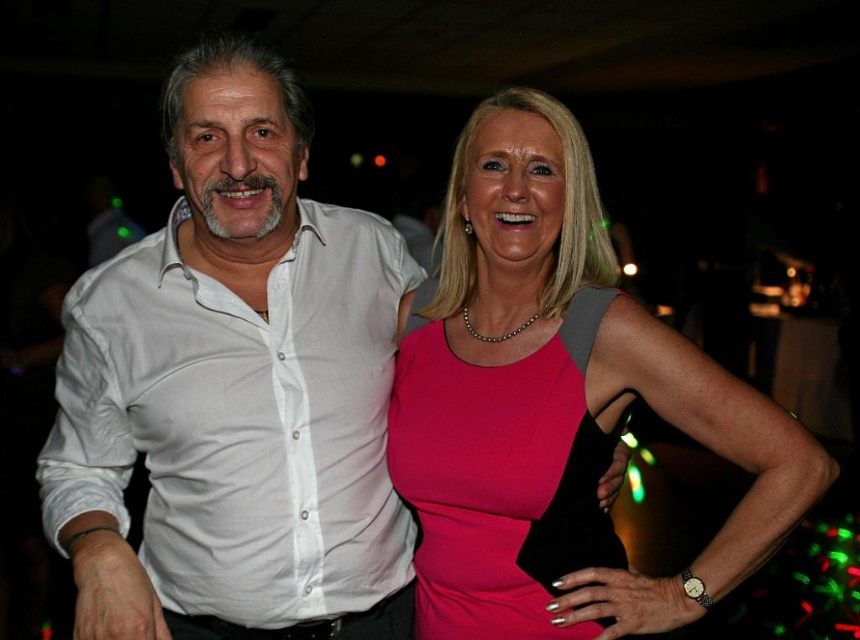
Between point (215, 536) and point (542, 596), which one is positioned in front?

Point (542, 596)

Is white cotton shirt at left to the right of pink satin dress at center from the viewer's perspective?

Incorrect, white cotton shirt at left is not on the right side of pink satin dress at center.

This screenshot has width=860, height=640. Identify the location of white cotton shirt at left. (235, 390).

You are a GUI agent. You are given a task and a screenshot of the screen. Output one action in this format:
    pyautogui.click(x=<x>, y=<y>)
    Task: Click on the white cotton shirt at left
    
    Given the screenshot: What is the action you would take?
    pyautogui.click(x=235, y=390)

Between point (582, 305) and point (418, 433), which one is positioned in front?

Point (582, 305)

Is pink matte dress at center closer to the viewer compared to pink satin dress at center?

Yes, pink matte dress at center is in front of pink satin dress at center.

Where is `pink matte dress at center`? The height and width of the screenshot is (640, 860). pink matte dress at center is located at coordinates (559, 406).

Is white cotton shirt at left above pink matte dress at center?

Actually, white cotton shirt at left is below pink matte dress at center.

Where is `white cotton shirt at left`? white cotton shirt at left is located at coordinates (235, 390).